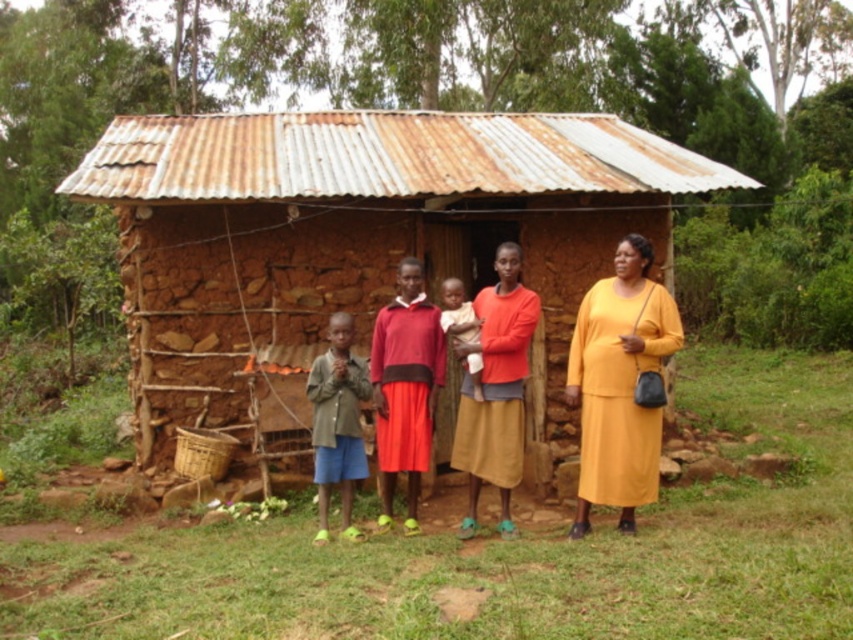
You are a fashion designer visiting this rural area and notice the matte yellow dress at right and the green fabric shirt at center. Which clothing item is bigger in size?

The matte yellow dress at right has a larger size compared to the green fabric shirt at center.

You are a photographer trying to capture the red matte skirt at center in your shot. The camera you are using has a focal length of 50mm. If you want to ensure the skirt is centered in the frame, where should you position your camera relative to the structure?

To center the red matte skirt at center in the frame, position your camera directly in front of the structure, aligning the camera lens with the point at coordinates approximately 0.606 on the x and 0.476 on the y axis relative to the image plane.